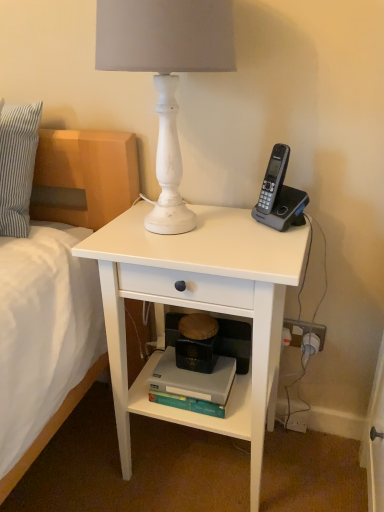
This screenshot has width=384, height=512. In order to click on free space in front of gray plastic phone at upper right in this screenshot , I will do `click(265, 246)`.